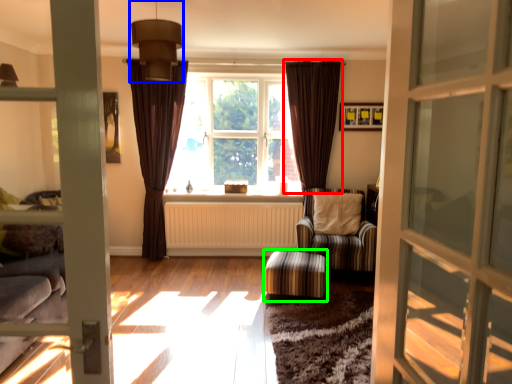
Question: Based on their relative distances, which object is nearer to curtain (highlighted by a red box)? Choose from light fixture (highlighted by a blue box) and stool (highlighted by a green box).

Choices:
 (A) light fixture
 (B) stool

Answer: (B)